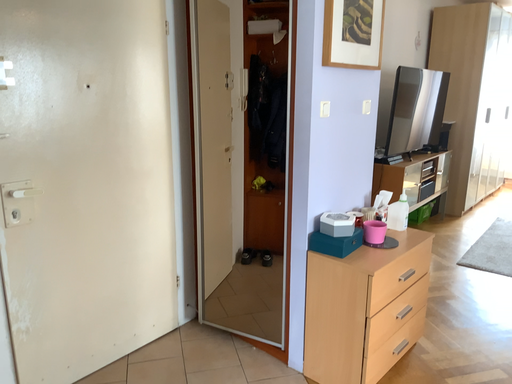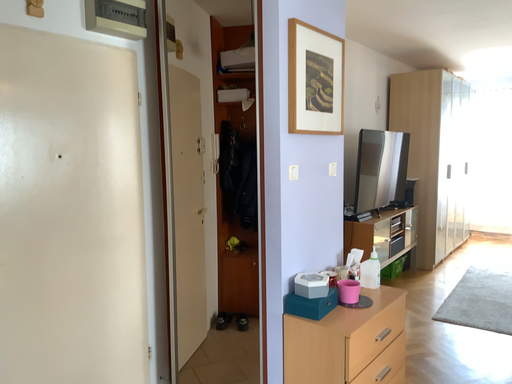
Question: How did the camera likely rotate when shooting the video?

Choices:
 (A) rotated downward
 (B) rotated upward

Answer: (B)